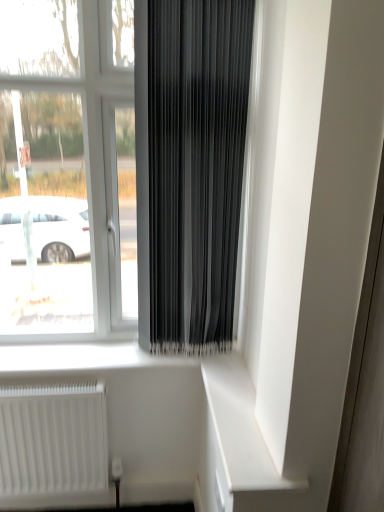
Describe the element at coordinates (76, 127) in the screenshot. The height and width of the screenshot is (512, 384). I see `transparent glass window at center` at that location.

This screenshot has width=384, height=512. In order to click on transparent glass window at center in this screenshot , I will do `click(76, 127)`.

Measure the distance between point [59,437] and camera.

Point [59,437] is 1.68 meters from camera.

Find the location of a particular element. This screenshot has height=512, width=384. transparent glass window at center is located at coordinates (76, 127).

Would you say transparent glass window at center is a long distance from white matte shelf at lower right?

No, transparent glass window at center is not far from white matte shelf at lower right.

Considering the relative positions of transparent glass window at center and white matte shelf at lower right in the image provided, is transparent glass window at center behind white matte shelf at lower right?

Yes, transparent glass window at center is further from the camera.

From the picture: Can you tell me how much transparent glass window at center and white matte shelf at lower right differ in facing direction?

transparent glass window at center and white matte shelf at lower right are facing 90.9 degrees away from each other.

Is transparent glass window at center turned away from white matte shelf at lower right?

No.

Is the position of white matte shelf at lower right more distant than that of white matte radiator at lower left?

No, white matte shelf at lower right is in front of white matte radiator at lower left.

This screenshot has height=512, width=384. I want to click on shelf above the white matte radiator at lower left (from the image's perspective), so click(x=240, y=429).

Does white matte shelf at lower right have a lesser width compared to white matte radiator at lower left?

In fact, white matte shelf at lower right might be wider than white matte radiator at lower left.

Is white matte shelf at lower right touching white matte radiator at lower left?

No, white matte shelf at lower right is not in contact with white matte radiator at lower left.

From a real-world perspective, who is located lower, black matte curtain at center or white matte radiator at lower left?

In real-world perspective, white matte radiator at lower left is lower.

Is black matte curtain at center taller or shorter than white matte radiator at lower left?

In the image, black matte curtain at center appears to be taller than white matte radiator at lower left.

Considering the relative sizes of black matte curtain at center and white matte radiator at lower left in the image provided, is black matte curtain at center wider than white matte radiator at lower left?

Yes, black matte curtain at center is wider than white matte radiator at lower left.

Between white matte shelf at lower right and transparent glass window at center, which one is positioned in front?

Positioned in front is white matte shelf at lower right.

Does white matte shelf at lower right have a lesser height compared to transparent glass window at center?

Indeed, white matte shelf at lower right has a lesser height compared to transparent glass window at center.

Considering the sizes of objects white matte shelf at lower right and transparent glass window at center in the image provided, who is thinner, white matte shelf at lower right or transparent glass window at center?

Thinner between the two is white matte shelf at lower right.

In the scene shown: From a real-world perspective, relative to transparent glass window at center, is white matte shelf at lower right vertically above or below?

white matte shelf at lower right is below transparent glass window at center.

From the image's perspective, is white matte shelf at lower right on top of black matte curtain at center?

No, from the image's perspective, white matte shelf at lower right is not above black matte curtain at center.

Is white matte shelf at lower right aimed at black matte curtain at center?

No, white matte shelf at lower right does not turn towards black matte curtain at center.

Looking at this image, what's the angular difference between white matte shelf at lower right and black matte curtain at center's facing directions?

white matte shelf at lower right and black matte curtain at center are facing 90 degrees away from each other.

Relative to black matte curtain at center, is white matte shelf at lower right in front or behind?

white matte shelf at lower right is positioned closer to the viewer than black matte curtain at center.

From the picture: From the image's perspective, does white matte radiator at lower left appear higher than black matte curtain at center?

Incorrect, from the image's perspective, white matte radiator at lower left is lower than black matte curtain at center.

Based on their sizes in the image, would you say white matte radiator at lower left is bigger or smaller than black matte curtain at center?

white matte radiator at lower left is smaller than black matte curtain at center.

Based on the photo, which is behind, white matte radiator at lower left or black matte curtain at center?

white matte radiator at lower left.

Would you say white matte radiator at lower left is outside black matte curtain at center?

white matte radiator at lower left lies outside black matte curtain at center's area.

Between white matte radiator at lower left and white matte shelf at lower right, which one has larger width?

white matte shelf at lower right.

At what (x,y) coordinates should I click in order to perform the action: click on radiator below the white matte shelf at lower right (from the image's perspective). Please return your answer as a coordinate pair (x, y). The width and height of the screenshot is (384, 512). Looking at the image, I should click on click(53, 439).

Does white matte radiator at lower left appear on the left side of white matte shelf at lower right?

Yes, white matte radiator at lower left is to the left of white matte shelf at lower right.

This screenshot has height=512, width=384. I want to click on window above the white matte shelf at lower right (from the image's perspective), so click(76, 127).

Where is `radiator located behind the white matte shelf at lower right`? This screenshot has width=384, height=512. radiator located behind the white matte shelf at lower right is located at coordinates (53, 439).

When comparing their distances from black matte curtain at center, does transparent glass window at center or white matte radiator at lower left seem closer?

Based on the image, transparent glass window at center appears to be nearer to black matte curtain at center.

Looking at the image, which one is located closer to white matte shelf at lower right, transparent glass window at center or black matte curtain at center?

Among the two, black matte curtain at center is located nearer to white matte shelf at lower right.

From the image, which object appears to be nearer to transparent glass window at center, white matte shelf at lower right or black matte curtain at center?

black matte curtain at center.

Looking at the image, which one is located closer to white matte shelf at lower right, transparent glass window at center or white matte radiator at lower left?

white matte radiator at lower left.

Which object lies nearer to the anchor point white matte radiator at lower left, black matte curtain at center or transparent glass window at center?

transparent glass window at center is positioned closer to the anchor white matte radiator at lower left.

From the image, which object appears to be farther from white matte shelf at lower right, black matte curtain at center or transparent glass window at center?

transparent glass window at center.

When comparing their distances from transparent glass window at center, does black matte curtain at center or white matte radiator at lower left seem closer?

black matte curtain at center is positioned closer to the anchor transparent glass window at center.

Considering their positions, is black matte curtain at center positioned further to transparent glass window at center than white matte shelf at lower right?

white matte shelf at lower right is positioned further to the anchor transparent glass window at center.

This screenshot has width=384, height=512. I want to click on curtain between transparent glass window at center and white matte shelf at lower right vertically, so click(190, 167).

I want to click on shelf between transparent glass window at center and white matte radiator at lower left in the up-down direction, so click(240, 429).

You are a GUI agent. You are given a task and a screenshot of the screen. Output one action in this format:
    pyautogui.click(x=<x>, y=<y>)
    Task: Click on the curtain between transparent glass window at center and white matte radiator at lower left in the vertical direction
    This screenshot has height=512, width=384.
    Given the screenshot: What is the action you would take?
    pyautogui.click(x=190, y=167)

The width and height of the screenshot is (384, 512). Identify the location of shelf between black matte curtain at center and white matte radiator at lower left in the up-down direction. (240, 429).